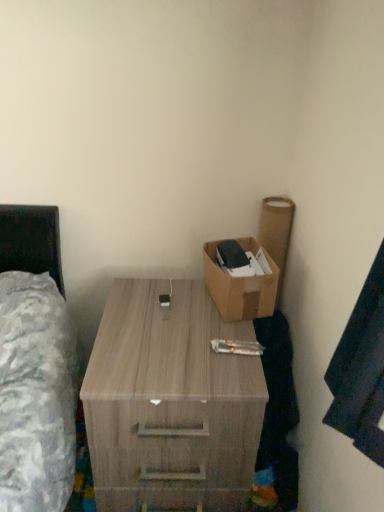
Question: Is wooden desk at center bigger or smaller than brown cardboard box at upper right?

Choices:
 (A) big
 (B) small

Answer: (A)

Question: In the image, is wooden desk at center on the left side or the right side of brown cardboard box at upper right?

Choices:
 (A) left
 (B) right

Answer: (A)

Question: Is wooden desk at center spatially inside brown cardboard box at upper right, or outside of it?

Choices:
 (A) outside
 (B) inside

Answer: (A)

Question: Does point (208, 268) appear closer or farther from the camera than point (140, 416)?

Choices:
 (A) closer
 (B) farther

Answer: (B)

Question: Do you think brown cardboard box at upper right is within wooden desk at center, or outside of it?

Choices:
 (A) inside
 (B) outside

Answer: (B)

Question: From the image's perspective, relative to wooden desk at center, is brown cardboard box at upper right above or below?

Choices:
 (A) above
 (B) below

Answer: (A)

Question: In the image, is brown cardboard box at upper right positioned in front of or behind wooden desk at center?

Choices:
 (A) behind
 (B) front

Answer: (A)